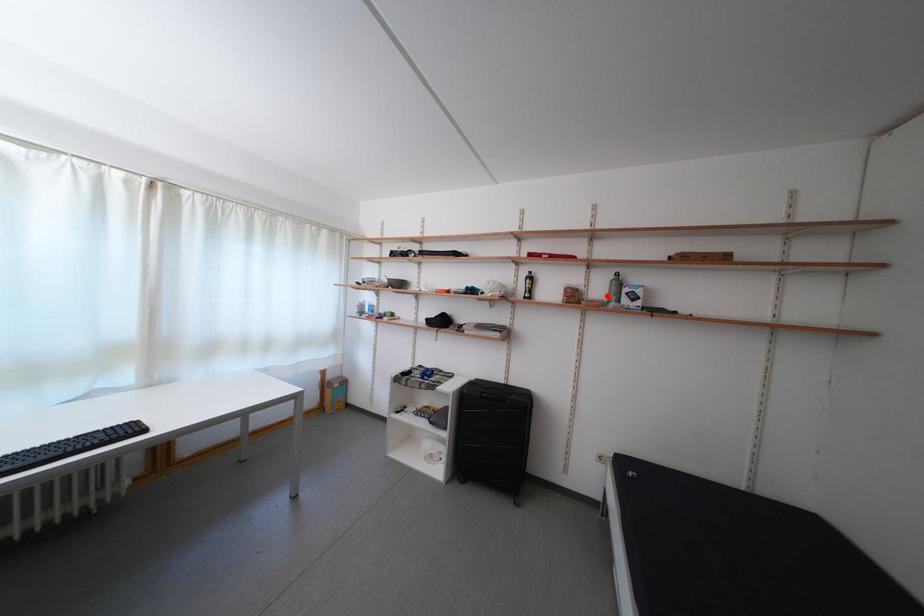
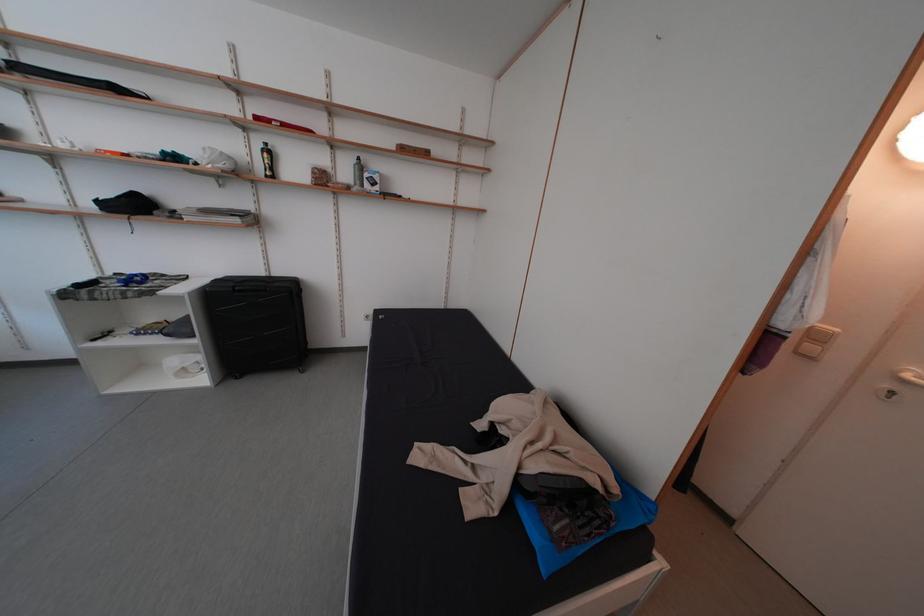
Where in the second image is the point corresponding to the highlighted location from the first image?

(354, 179)